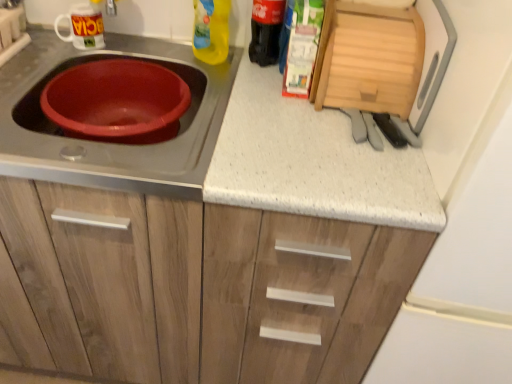
Find the location of a particular element. The height and width of the screenshot is (384, 512). free space in front of white glossy mug at upper left, placed as the first appliance when sorted from left to right is located at coordinates point(53,71).